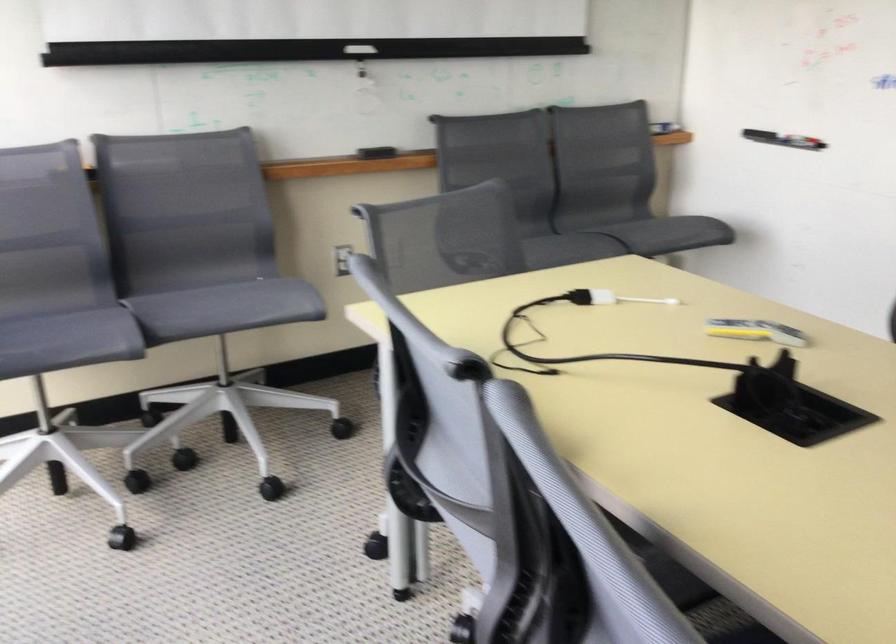
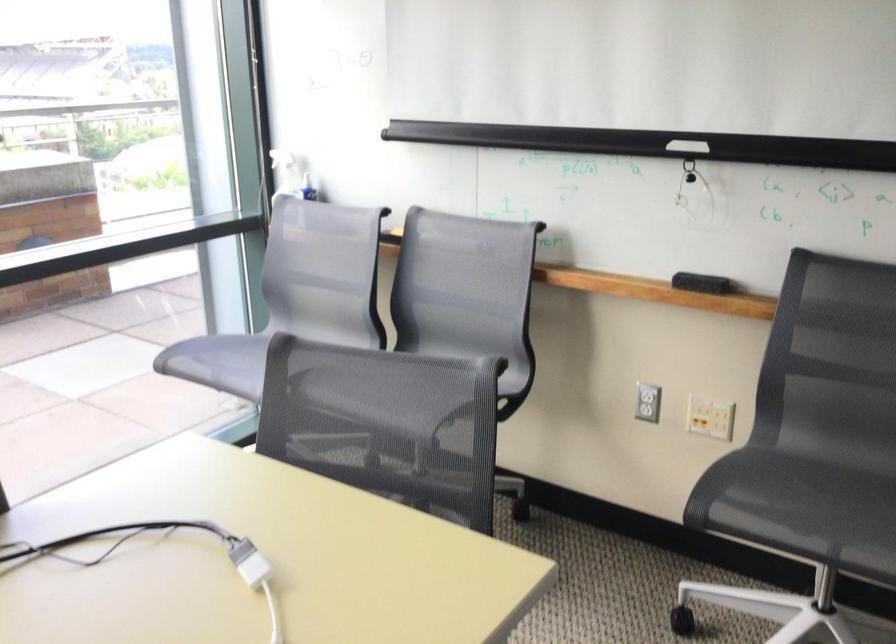
Locate, in the second image, the point that corresponds to point (375, 149) in the first image.

(701, 283)